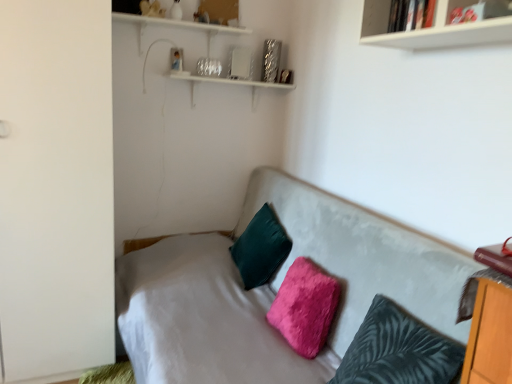
Question: Is fuzzy pink pillow at center, placed as the second pillow when sorted from back to front, in front of or behind fuzzy dark teal pillow at center, which is the 3th pillow from back to front, in the image?

Choices:
 (A) front
 (B) behind

Answer: (B)

Question: Would you say fuzzy pink pillow at center, marked as the second pillow in a front-to-back arrangement, is to the left or to the right of fuzzy dark teal pillow at center, which is counted as the first pillow, starting from the front, in the picture?

Choices:
 (A) right
 (B) left

Answer: (B)

Question: Based on their relative distances, which object is farther from the velvet gray couch at center?

Choices:
 (A) fuzzy dark teal pillow at center, which is counted as the first pillow, starting from the front
 (B) velvet green pillow at center, which is the third pillow from front to back
 (C) white matte wardrobe at left
 (D) fuzzy pink pillow at center, placed as the second pillow when sorted from back to front
 (E) white glossy bookshelf at upper right

Answer: (E)

Question: Estimate the real-world distances between objects in this image. Which object is farther from the velvet gray couch at center?

Choices:
 (A) fuzzy pink pillow at center, placed as the second pillow when sorted from back to front
 (B) white matte wardrobe at left
 (C) velvet green pillow at center, which is the 1th pillow in back-to-front order
 (D) fuzzy dark teal pillow at center, which is counted as the first pillow, starting from the front
 (E) white glossy bookshelf at upper right

Answer: (E)